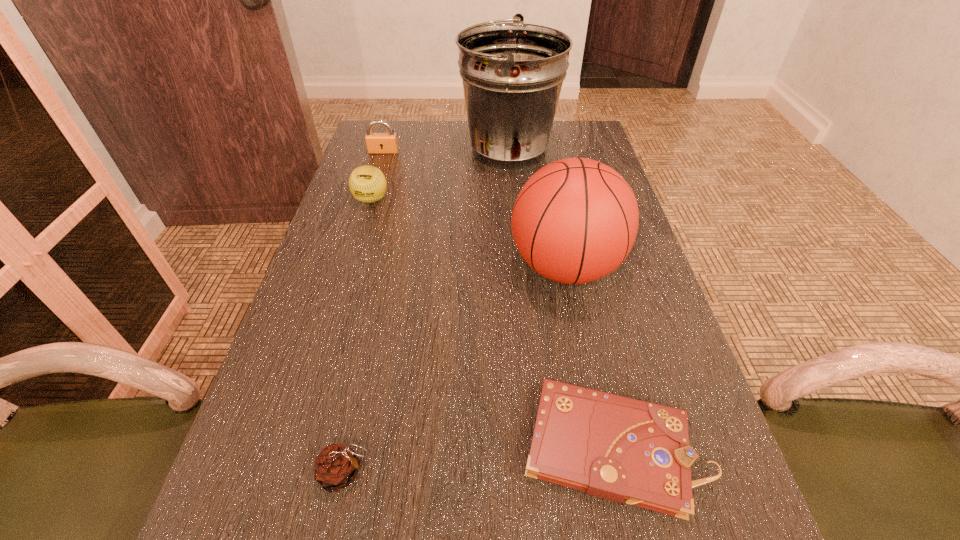
Locate an element on the screen. This screenshot has height=540, width=960. free area in between the notebook and the third nearest object is located at coordinates (590, 357).

Identify the location of unoccupied position between the second tallest object and the padlock. The height and width of the screenshot is (540, 960). (474, 210).

Locate an element on the screen. The width and height of the screenshot is (960, 540). free area in between the third nearest object and the fifth tallest object is located at coordinates (455, 370).

Identify the location of free spot between the notebook and the softball. Image resolution: width=960 pixels, height=540 pixels. (492, 323).

Identify the location of vacant area between the fourth nearest object and the second shortest object. This screenshot has height=540, width=960. pos(358,336).

Locate an element on the screen. The width and height of the screenshot is (960, 540). free space that is in between the fourth nearest object and the basketball is located at coordinates (468, 234).

Find the location of a particular element. This screenshot has width=960, height=540. free spot between the softball and the bucket is located at coordinates (440, 175).

The height and width of the screenshot is (540, 960). What are the coordinates of `empty location between the padlock and the shortest object` in the screenshot? It's located at (499, 299).

You are a GUI agent. You are given a task and a screenshot of the screen. Output one action in this format:
    pyautogui.click(x=<x>, y=<y>)
    Task: Click on the object that is the closest to the shortest object
    This screenshot has height=540, width=960.
    Given the screenshot: What is the action you would take?
    pyautogui.click(x=575, y=220)

Identify which object is located as the second nearest to the fourth farthest object. Please provide its 2D coordinates. Your answer should be formatted as a tuple, i.e. [(x, y)], where the tuple contains the x and y coordinates of a point satisfying the conditions above.

[(512, 73)]